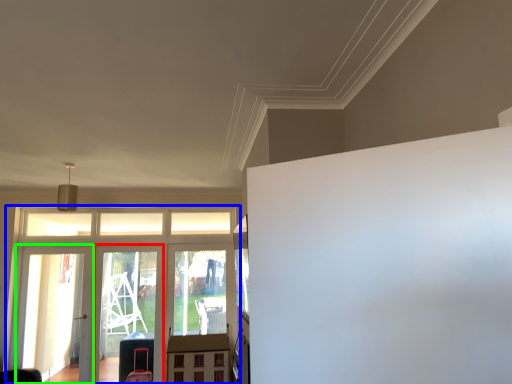
Question: Which object is positioned farthest from screen door (highlighted by a red box)? Select from elevator (highlighted by a blue box) and screen door (highlighted by a green box).

Choices:
 (A) elevator
 (B) screen door

Answer: (B)